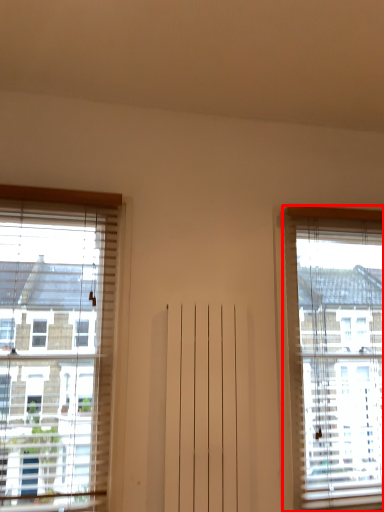
Question: In this image, where is window (annotated by the red box) located relative to window?

Choices:
 (A) right
 (B) left

Answer: (A)